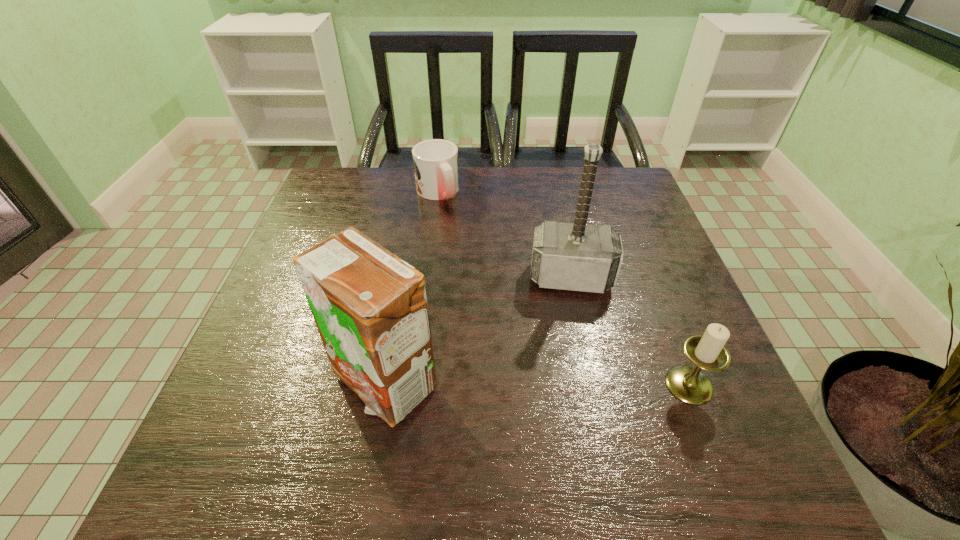
The image size is (960, 540). I want to click on carton, so click(370, 307).

The height and width of the screenshot is (540, 960). Find the location of `candle holder`. candle holder is located at coordinates [x=707, y=351].

Find the location of a particular element. The height and width of the screenshot is (540, 960). the rightmost object is located at coordinates (707, 351).

Where is `the third object from left to right`? Image resolution: width=960 pixels, height=540 pixels. the third object from left to right is located at coordinates [x=576, y=256].

At what (x,y) coordinates should I click in order to perform the action: click on hammer. Please return your answer as a coordinate pair (x, y). Looking at the image, I should click on (576, 256).

Where is `the farthest object`? the farthest object is located at coordinates (435, 161).

This screenshot has width=960, height=540. Find the location of `mug`. mug is located at coordinates (435, 161).

Locate an element on the screen. blank space located on the back of the third tallest object is located at coordinates point(638,256).

Locate an element on the screen. The image size is (960, 540). vacant space located 0.100m for striking with the head of the hammer is located at coordinates (570, 334).

At what (x,y) coordinates should I click in order to perform the action: click on blank space located for striking with the head of the hammer. Please return your answer as a coordinate pair (x, y). The height and width of the screenshot is (540, 960). Looking at the image, I should click on (570, 362).